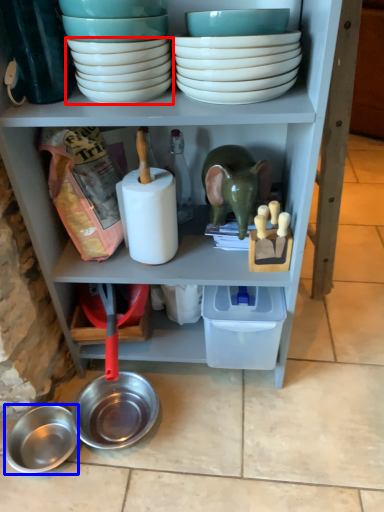
Question: Which object is further to the camera taking this photo, bowl (highlighted by a red box) or bowl (highlighted by a blue box)?

Choices:
 (A) bowl
 (B) bowl

Answer: (B)